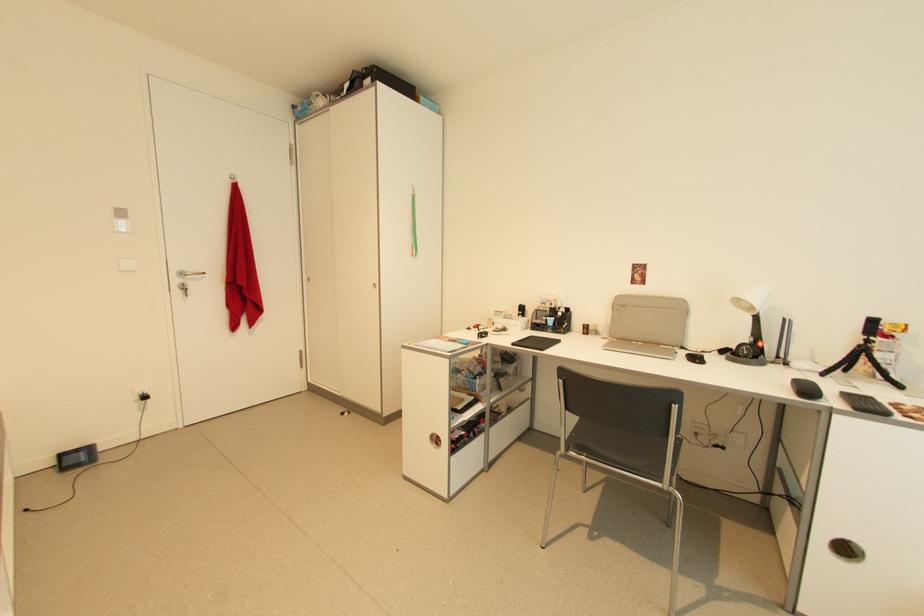
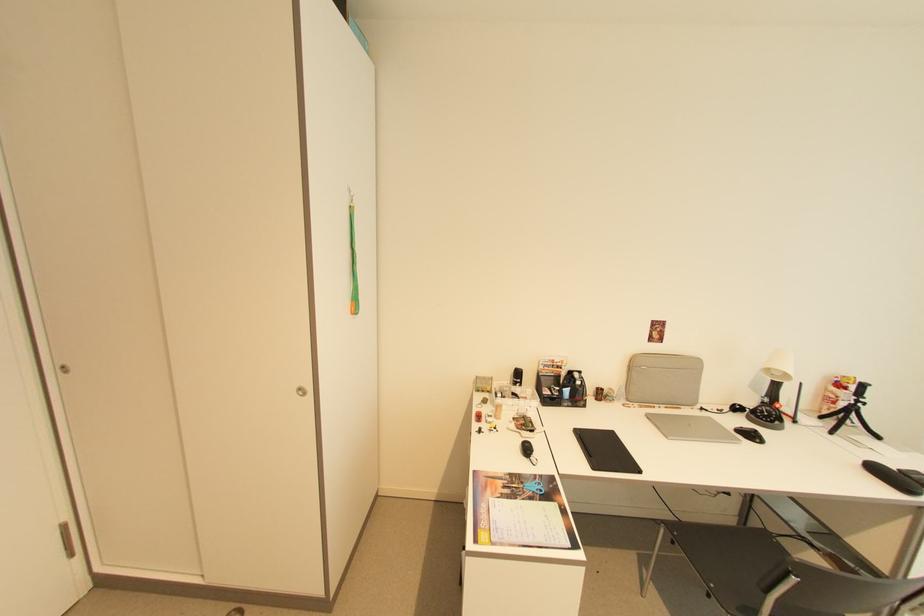
Question: I am providing you with two images of the same scene from different viewpoints. After the viewpoint changes to image2, which objects are now occluded?

Choices:
 (A) green lanyard
 (B) black computer mouse
 (C) grey laptop case
 (D) none of these

Answer: (D)